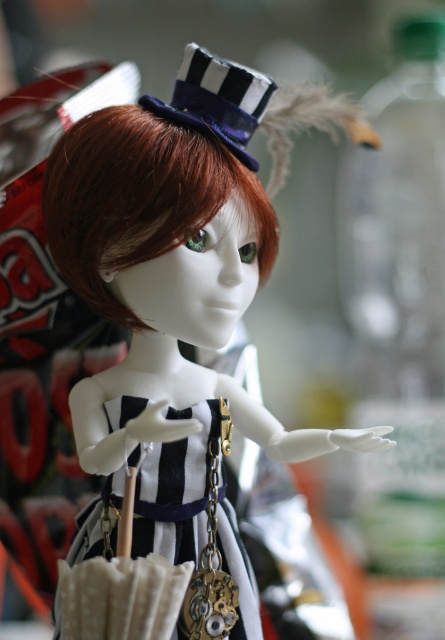
You are a fashion designer who wants to create a new outfit for a doll. You have two options for the dress at the center of the image. Which dress is wider, the matte black dress at center or the black striped fabric dress at center?

The matte black dress at center is wider than the black striped fabric dress at center.

You are observing the doll and need to determine which of the two points, point [169,115] or point [195,518], is nearer to you. Based on the scene, which point is closer?

Point [169,115] is closer to the viewer than point [195,518].

You are a photographer setting up for a closeup shot of the shiny brown wig at center. The camera is positioned 30 inches away from the wig. Will the wig be within the camera focus range if the camera has a minimum focus distance of 32 inches?

The shiny brown wig at center is 33.09 inches from viewer. Since the camera has a minimum focus distance of 32 inches, the wig is just beyond the camera focus range. The photographer needs to move the camera closer to 32 inches or adjust the focus settings to capture the wig clearly.